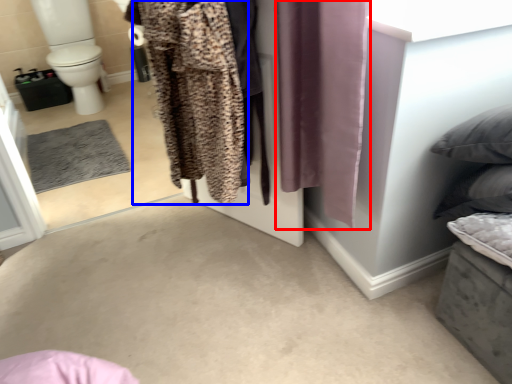
Question: Among these objects, which one is nearest to the camera, curtain (highlighted by a red box) or clothing (highlighted by a blue box)?

Choices:
 (A) curtain
 (B) clothing

Answer: (A)